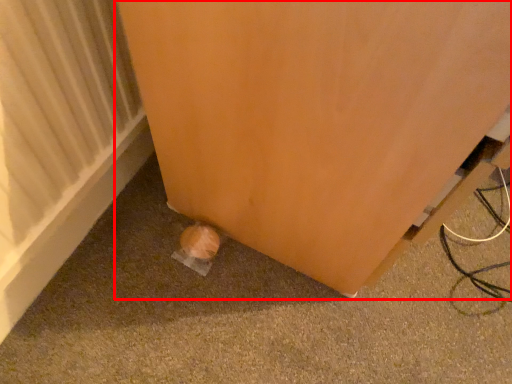
Question: In this image, where is furniture (annotated by the red box) located relative to radiator?

Choices:
 (A) left
 (B) right

Answer: (B)